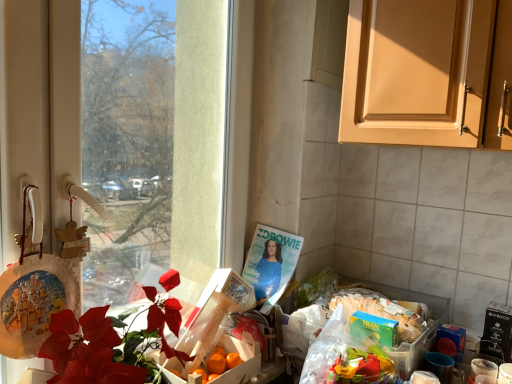
Question: Should I look upward or downward to see wooden crate of oranges at center, which is the 1th box in top-to-bottom order?

Choices:
 (A) up
 (B) down

Answer: (B)

Question: Does wooden crate of oranges at center, which is the 1th box in top-to-bottom order, have a smaller size compared to orange matte box at center, positioned as the first box in bottom-to-top order?

Choices:
 (A) yes
 (B) no

Answer: (B)

Question: Considering the relative positions of wooden crate of oranges at center, which ranks as the 2th box in bottom-to-top order, and orange matte box at center, positioned as the first box in bottom-to-top order, in the image provided, is wooden crate of oranges at center, which ranks as the 2th box in bottom-to-top order, to the left of orange matte box at center, positioned as the first box in bottom-to-top order, from the viewer's perspective?

Choices:
 (A) yes
 (B) no

Answer: (B)

Question: Considering the relative sizes of wooden crate of oranges at center, which is the 1th box in top-to-bottom order, and orange matte box at center, positioned as the first box in bottom-to-top order, in the image provided, is wooden crate of oranges at center, which is the 1th box in top-to-bottom order, taller than orange matte box at center, positioned as the first box in bottom-to-top order,?

Choices:
 (A) yes
 (B) no

Answer: (A)

Question: From the image's perspective, would you say wooden crate of oranges at center, which ranks as the 2th box in bottom-to-top order, is shown under orange matte box at center, positioned as the first box in bottom-to-top order?

Choices:
 (A) yes
 (B) no

Answer: (B)

Question: Is wooden crate of oranges at center, which ranks as the 2th box in bottom-to-top order, placed right next to orange matte box at center, positioned as the first box in bottom-to-top order?

Choices:
 (A) yes
 (B) no

Answer: (A)

Question: Does wooden crate of oranges at center, which is the 1th box in top-to-bottom order, have a greater width compared to orange matte box at center, the 2th box when ordered from top to bottom?

Choices:
 (A) yes
 (B) no

Answer: (A)

Question: Considering the relative sizes of wooden crate of oranges at center, which ranks as the 2th box in bottom-to-top order, and green matte box of tran rice at lower right in the image provided, is wooden crate of oranges at center, which ranks as the 2th box in bottom-to-top order, taller than green matte box of tran rice at lower right?

Choices:
 (A) yes
 (B) no

Answer: (A)

Question: From the image's perspective, is wooden crate of oranges at center, which is the 1th box in top-to-bottom order, located above green matte box of tran rice at lower right?

Choices:
 (A) yes
 (B) no

Answer: (B)

Question: Considering the relative positions of wooden crate of oranges at center, which ranks as the 2th box in bottom-to-top order, and green matte box of tran rice at lower right in the image provided, is wooden crate of oranges at center, which ranks as the 2th box in bottom-to-top order, behind green matte box of tran rice at lower right?

Choices:
 (A) no
 (B) yes

Answer: (A)

Question: Is wooden crate of oranges at center, which ranks as the 2th box in bottom-to-top order, closer to the viewer compared to green matte box of tran rice at lower right?

Choices:
 (A) yes
 (B) no

Answer: (A)

Question: Is wooden crate of oranges at center, which ranks as the 2th box in bottom-to-top order, turned away from green matte box of tran rice at lower right?

Choices:
 (A) no
 (B) yes

Answer: (A)

Question: Can we say wooden crate of oranges at center, which ranks as the 2th box in bottom-to-top order, lies outside green matte box of tran rice at lower right?

Choices:
 (A) yes
 (B) no

Answer: (A)

Question: Considering the relative sizes of white glossy coffee cup at lower right and transparent glass window at left in the image provided, is white glossy coffee cup at lower right taller than transparent glass window at left?

Choices:
 (A) yes
 (B) no

Answer: (B)